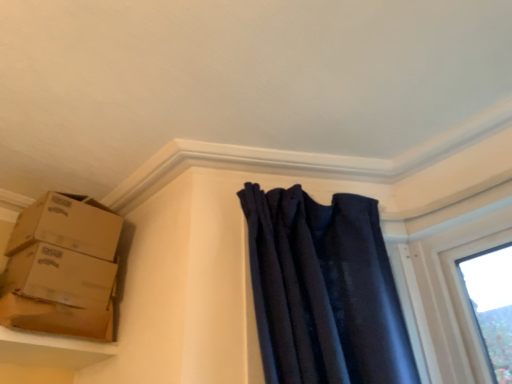
Question: Can you confirm if brown cardboard box at left is smaller than smooth beige shelf at lower left?

Choices:
 (A) yes
 (B) no

Answer: (A)

Question: Considering the relative sizes of brown cardboard box at left and smooth beige shelf at lower left in the image provided, is brown cardboard box at left shorter than smooth beige shelf at lower left?

Choices:
 (A) yes
 (B) no

Answer: (B)

Question: Considering the relative positions of brown cardboard box at left and smooth beige shelf at lower left in the image provided, is brown cardboard box at left to the left of smooth beige shelf at lower left from the viewer's perspective?

Choices:
 (A) yes
 (B) no

Answer: (B)

Question: Are brown cardboard box at left and smooth beige shelf at lower left making contact?

Choices:
 (A) yes
 (B) no

Answer: (A)

Question: Is brown cardboard box at left further to the viewer compared to smooth beige shelf at lower left?

Choices:
 (A) yes
 (B) no

Answer: (A)

Question: Does brown cardboard box at left turn towards smooth beige shelf at lower left?

Choices:
 (A) no
 (B) yes

Answer: (A)

Question: From the image's perspective, would you say brown cardboard boxes at upper left, the 2th box in the bottom-to-top sequence, is positioned over smooth beige shelf at lower left?

Choices:
 (A) yes
 (B) no

Answer: (A)

Question: Considering the relative sizes of brown cardboard boxes at upper left, which is the first box from top to bottom, and smooth beige shelf at lower left in the image provided, is brown cardboard boxes at upper left, which is the first box from top to bottom, shorter than smooth beige shelf at lower left?

Choices:
 (A) no
 (B) yes

Answer: (A)

Question: Is there a large distance between brown cardboard boxes at upper left, the 2th box in the bottom-to-top sequence, and smooth beige shelf at lower left?

Choices:
 (A) yes
 (B) no

Answer: (B)

Question: From a real-world perspective, is brown cardboard boxes at upper left, the 2th box in the bottom-to-top sequence, over smooth beige shelf at lower left?

Choices:
 (A) yes
 (B) no

Answer: (A)

Question: From the image's perspective, would you say brown cardboard boxes at upper left, which is the first box from top to bottom, is shown under smooth beige shelf at lower left?

Choices:
 (A) no
 (B) yes

Answer: (A)

Question: Does brown cardboard boxes at upper left, the 2th box in the bottom-to-top sequence, touch smooth beige shelf at lower left?

Choices:
 (A) no
 (B) yes

Answer: (A)

Question: Does smooth beige shelf at lower left come in front of brown cardboard boxes at left, marked as the 2th box in a top-to-bottom arrangement?

Choices:
 (A) no
 (B) yes

Answer: (B)